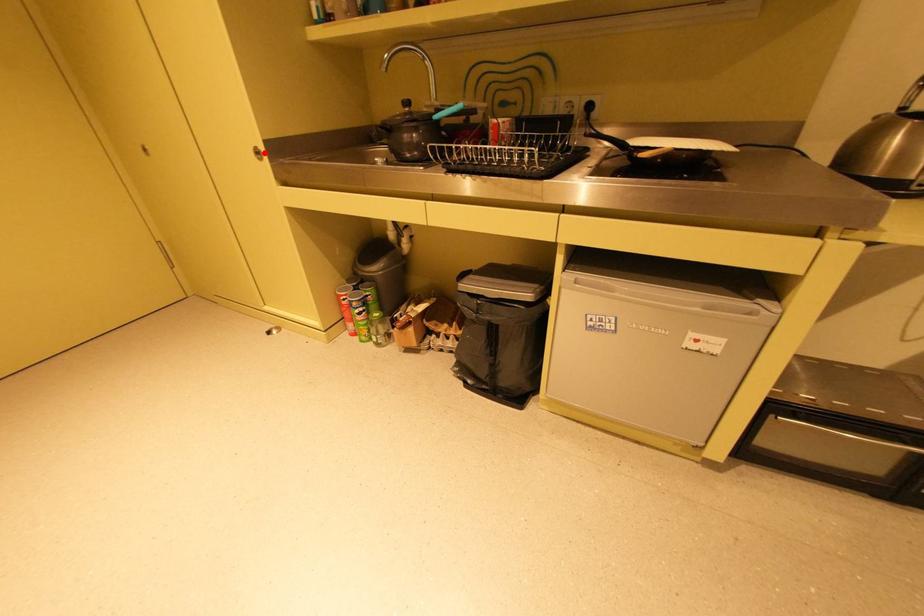
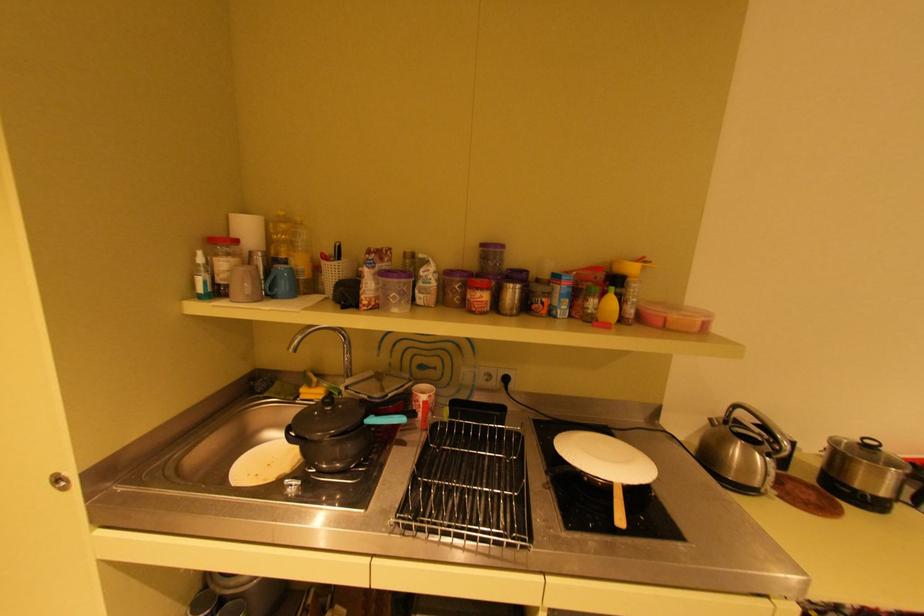
The point at the highlighted location is marked in the first image. Where is the corresponding point in the second image?

(65, 479)